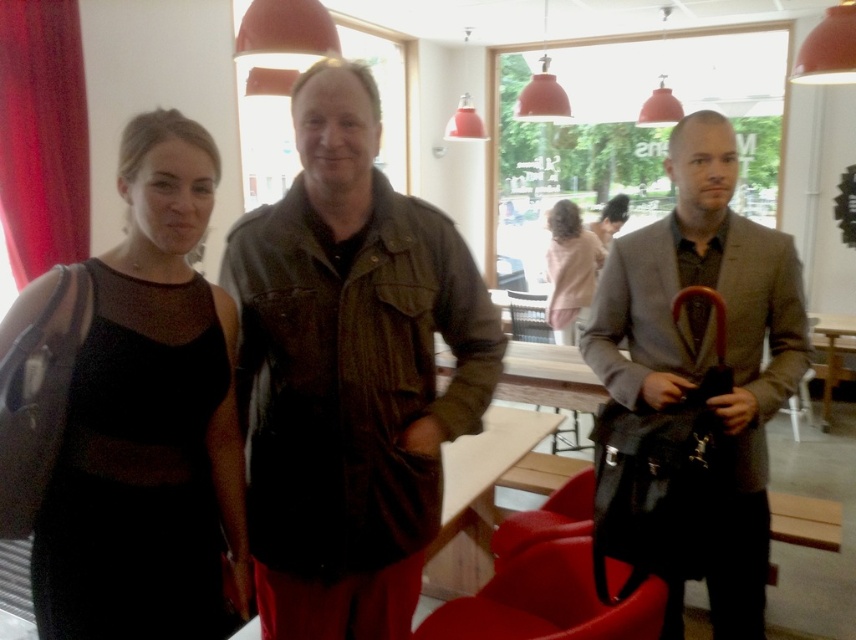
Question: Which object appears farthest from the camera in this image?

Choices:
 (A) black matte dress at left
 (B) leather jacket at center
 (C) light pink sweater at center
 (D) matte gray suit at right

Answer: (C)

Question: Does leather jacket at center have a larger size compared to matte gray suit at right?

Choices:
 (A) no
 (B) yes

Answer: (A)

Question: Estimate the real-world distances between objects in this image. Which object is farther from the black matte dress at left?

Choices:
 (A) light pink sweater at center
 (B) leather jacket at center
 (C) matte gray suit at right

Answer: (A)

Question: Is matte gray suit at right in front of light pink sweater at center?

Choices:
 (A) no
 (B) yes

Answer: (B)

Question: Considering the relative positions of black matte dress at left and light pink sweater at center in the image provided, where is black matte dress at left located with respect to light pink sweater at center?

Choices:
 (A) below
 (B) above

Answer: (A)

Question: Among these objects, which one is nearest to the camera?

Choices:
 (A) leather jacket at center
 (B) matte gray suit at right
 (C) light pink sweater at center
 (D) black matte dress at left

Answer: (D)